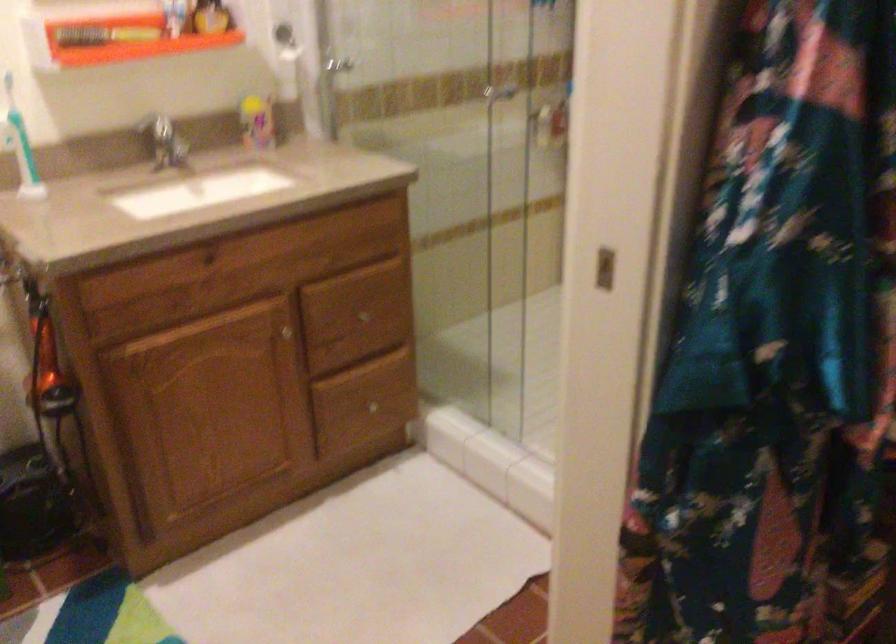
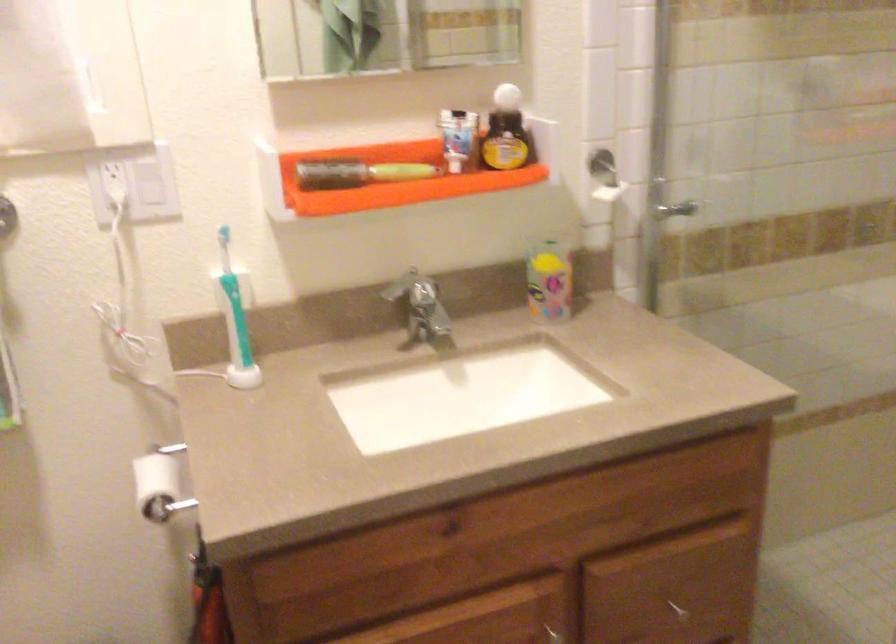
Find the pixel in the second image that matches the point at 366,323 in the first image.

(677, 609)